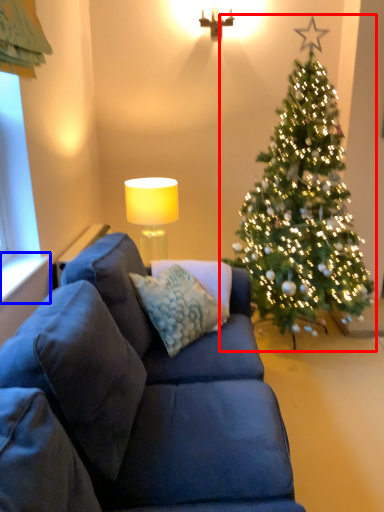
Question: Among these objects, which one is farthest to the camera, christmas tree (highlighted by a red box) or window sill (highlighted by a blue box)?

Choices:
 (A) christmas tree
 (B) window sill

Answer: (A)